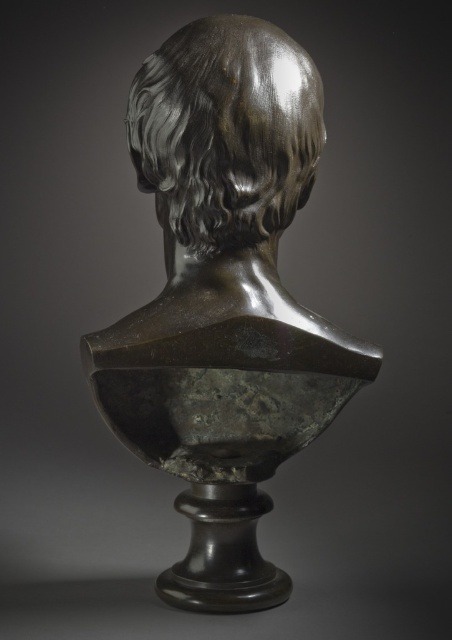
From the picture: You are standing 10 feet away from the bronze bust sculpture. A point at coordinates point (282, 381) is part of the sculpture. Can you estimate whether this point is closer to you or farther away compared to the front of the sculpture?

The distance of point (282, 381) from viewer is 37.14 inches. Since you are standing 10 feet away, which is 120 inches, the point is closer to you than the front of the sculpture.

You are an art curator planning to install a new lighting system for the bronze bust sculpture. The sculpture is represented by the point at coordinates point (224, 298). To ensure even lighting, you need to know the exact position of the sculpture. What are the coordinates of the bronze bust at center?

The bronze bust at center is represented by point (224, 298).

From the picture: You are an art conservator examining the bronze bust sculpture. You notice two points on the sculpture marked at coordinates point [144,92] and point [189,38]. From your vantage point, which point is closer to you?

Point [189,38] is closer to you because it is in front of point [144,92].